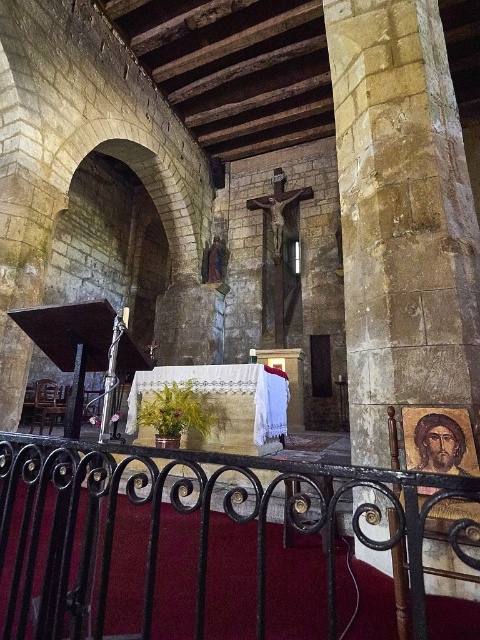
Looking at this image, you are standing in the church and want to move from the altar to the crucifix. The altar is at point (26, 442) and the crucifix is at point (383, 397). Which direction should you move to get closer to the crucifix?

To move closer to the crucifix at point (383, 397) from the altar at point (26, 442), you should move upward since point (383, 397) is above point (26, 442) in the image.

You are a visitor standing at the entrance of the church and want to see both the black wrought iron railing at center and the yellow stone pillar at center. Which one of these two objects will appear taller to you?

The yellow stone pillar at center is taller than the black wrought iron railing at center, so the yellow stone pillar at center will appear taller to you.

You are a visitor standing at the entrance of the stone church and want to approach the altar. There is a black wrought iron railing at center in your way. Can you walk around it to reach the altar?

The black wrought iron railing at center is positioned at the center of the church, so you can walk around it to reach the altar.